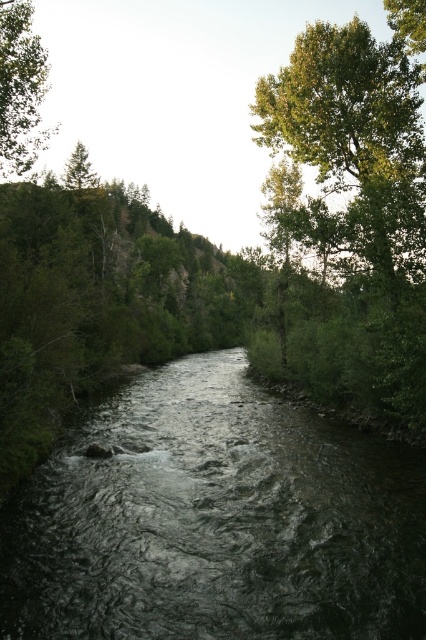
Can you confirm if green leafy tree at upper right is smaller than green leafy tree at upper left?

Correct, green leafy tree at upper right occupies less space than green leafy tree at upper left.

Describe the element at coordinates (344, 106) in the screenshot. I see `green leafy tree at upper right` at that location.

This screenshot has height=640, width=426. In order to click on green leafy tree at upper right in this screenshot , I will do `click(344, 106)`.

Who is higher up, dark gray water at center or green leafy tree at upper left?

green leafy tree at upper left

Is point (69, 556) positioned before point (17, 1)?

That is True.

Between point (158, 621) and point (43, 61), which one is positioned in front?

Point (158, 621) is in front.

Identify the location of dark gray water at center. (215, 520).

Which is in front, point (20, 3) or point (83, 145)?

Point (20, 3) is more forward.

Locate an element on the screen. The height and width of the screenshot is (640, 426). green leafy tree at upper left is located at coordinates (20, 88).